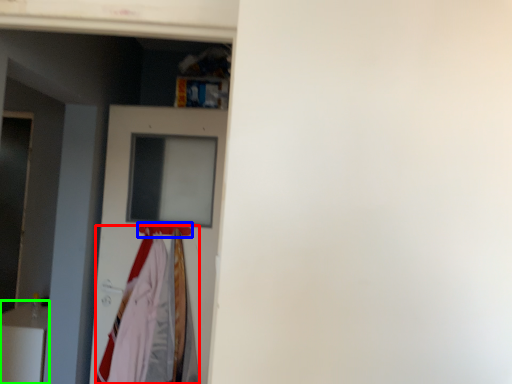
Question: Based on their relative distances, which object is nearer to clothing (highlighted by a red box)? Choose from hanger (highlighted by a blue box) and furniture (highlighted by a green box).

Choices:
 (A) hanger
 (B) furniture

Answer: (A)